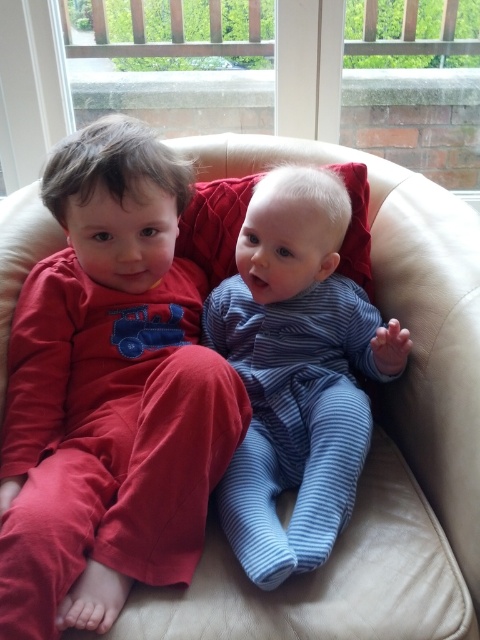
Question: Which of the following is the closest to the observer?

Choices:
 (A) (344, 518)
 (B) (60, 378)

Answer: (A)

Question: Is matte red pajamas at left thinner than blue striped onesie at center?

Choices:
 (A) yes
 (B) no

Answer: (B)

Question: Does matte red pajamas at left have a larger size compared to blue striped onesie at center?

Choices:
 (A) no
 (B) yes

Answer: (B)

Question: Which point appears closest to the camera in this image?

Choices:
 (A) (191, 186)
 (B) (260, 394)

Answer: (B)

Question: Among these objects, which one is nearest to the camera?

Choices:
 (A) blue striped onesie at center
 (B) matte red pajamas at left

Answer: (B)

Question: Is matte red pajamas at left bigger than blue striped onesie at center?

Choices:
 (A) yes
 (B) no

Answer: (A)